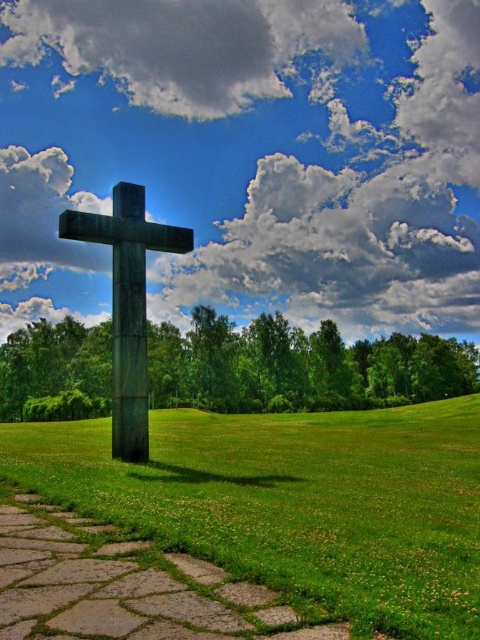
You are standing in front of a large dark cross on a grassy field. You want to place a small flower pot exactly 5 meters away from where you are standing. Can you determine if the green grass at center is within that distance?

The green grass at center is 4.73 meters away from camera, so yes, it is within the 5 meters distance.

You are standing at point (144, 189) and want to walk to the large dark cross in the foreground. Is the point (475, 516) between you and the cross?

Yes, point (475, 516) is between you and the large dark cross in the foreground because it is in front of point (144, 189) which is your current location.

You are standing at the point marked as point (295, 502) in the image. What is the immediate surface beneath your feet?

The immediate surface beneath your feet at point (295, 502) is green grass at center.